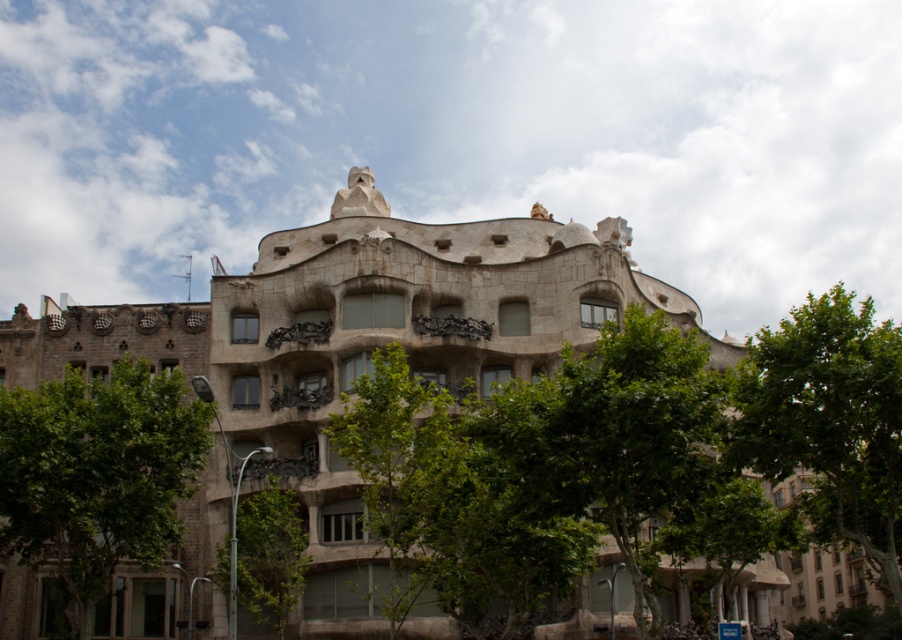
Which is above, green leafy tree at right or green leafy tree at center?

green leafy tree at center

Which is more to the left, green leafy tree at right or green leafy tree at center?

→ green leafy tree at center

I want to click on green leafy tree at right, so click(x=829, y=422).

What are the coordinates of `green leafy tree at right` in the screenshot? It's located at (829, 422).

Does green leafy tree at right have a larger size compared to green leafy tree at lower center?

Correct, green leafy tree at right is larger in size than green leafy tree at lower center.

Can you confirm if green leafy tree at right is positioned above green leafy tree at lower center?

Indeed, green leafy tree at right is positioned over green leafy tree at lower center.

Who is more forward, (812,477) or (216,552)?

Point (216,552) is more forward.

Identify the location of green leafy tree at right. (829, 422).

Does green leafy tree at lower left have a lesser height compared to green leafy tree at right?

Indeed, green leafy tree at lower left has a lesser height compared to green leafy tree at right.

Measure the distance between point [178,540] and camera.

Point [178,540] and camera are 224.80 feet apart.

Where is `green leafy tree at lower left`? green leafy tree at lower left is located at coordinates point(97,474).